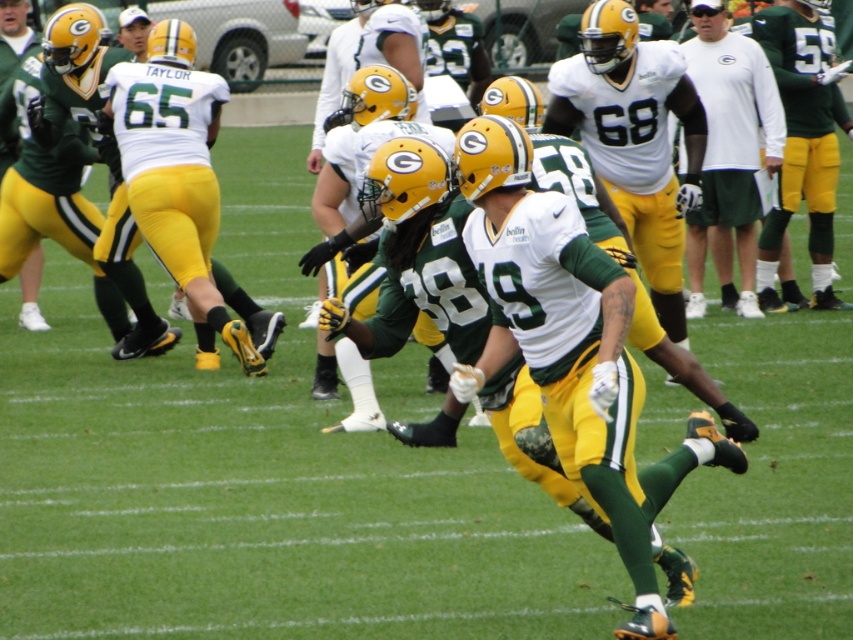
Question: Observing the image, what is the correct spatial positioning of matte white jersey at center in reference to white matte shirt at upper center?

Choices:
 (A) right
 (B) left

Answer: (B)

Question: Which point is closer to the camera?

Choices:
 (A) (592, 76)
 (B) (689, 225)

Answer: (A)

Question: Does matte white jersey at center have a greater width compared to white matte shirt at upper center?

Choices:
 (A) yes
 (B) no

Answer: (A)

Question: Is matte white jersey at center wider than white matte shirt at upper center?

Choices:
 (A) no
 (B) yes

Answer: (B)